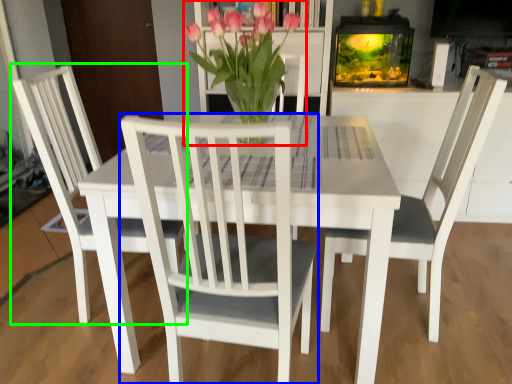
Question: Which object is the closest to the houseplant (highlighted by a red box)? Choose among these: chair (highlighted by a blue box) or chair (highlighted by a green box).

Choices:
 (A) chair
 (B) chair

Answer: (A)